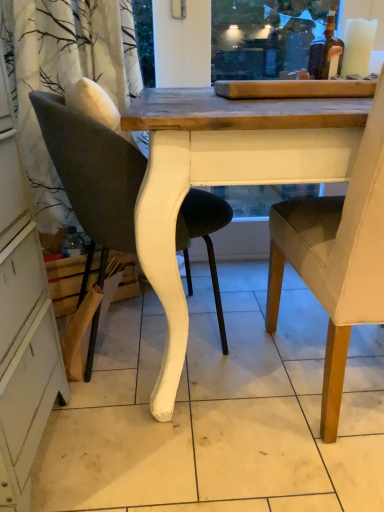
Question: Considering the relative sizes of white painted wood chair at left, the 2th chair viewed from the right, and light brown fabric chair at right, which is the 1th chair in right-to-left order, in the image provided, is white painted wood chair at left, the 2th chair viewed from the right, taller than light brown fabric chair at right, which is the 1th chair in right-to-left order,?

Choices:
 (A) no
 (B) yes

Answer: (A)

Question: From the image's perspective, is white painted wood chair at left, which is the 1th chair in left-to-right order, located above light brown fabric chair at right, the 2th chair in the left-to-right sequence?

Choices:
 (A) yes
 (B) no

Answer: (A)

Question: Is light brown fabric chair at right, the 2th chair in the left-to-right sequence, inside white painted wood chair at left, the 2th chair viewed from the right?

Choices:
 (A) no
 (B) yes

Answer: (A)

Question: Is white painted wood chair at left, the 2th chair viewed from the right, not near light brown fabric chair at right, which is the 1th chair in right-to-left order?

Choices:
 (A) yes
 (B) no

Answer: (B)

Question: Can you confirm if white painted wood chair at left, the 2th chair viewed from the right, is wider than light brown fabric chair at right, which is the 1th chair in right-to-left order?

Choices:
 (A) yes
 (B) no

Answer: (B)

Question: From a real-world perspective, is white painted wood chair at left, which is the 1th chair in left-to-right order, on top of light brown fabric chair at right, the 2th chair in the left-to-right sequence?

Choices:
 (A) yes
 (B) no

Answer: (B)

Question: Is light brown fabric chair at right, which is the 1th chair in right-to-left order, located outside white painted wood chair at left, the 2th chair viewed from the right?

Choices:
 (A) no
 (B) yes

Answer: (B)

Question: Can you confirm if light brown fabric chair at right, which is the 1th chair in right-to-left order, is positioned to the left of white painted wood chair at left, the 2th chair viewed from the right?

Choices:
 (A) no
 (B) yes

Answer: (A)

Question: Is there a large distance between light brown fabric chair at right, the 2th chair in the left-to-right sequence, and white painted wood chair at left, which is the 1th chair in left-to-right order?

Choices:
 (A) no
 (B) yes

Answer: (A)

Question: Does light brown fabric chair at right, the 2th chair in the left-to-right sequence, have a larger size compared to white painted wood chair at left, which is the 1th chair in left-to-right order?

Choices:
 (A) yes
 (B) no

Answer: (A)

Question: From a real-world perspective, does light brown fabric chair at right, the 2th chair in the left-to-right sequence, stand above white painted wood chair at left, which is the 1th chair in left-to-right order?

Choices:
 (A) yes
 (B) no

Answer: (A)

Question: Considering the relative sizes of light brown fabric chair at right, the 2th chair in the left-to-right sequence, and white painted wood chair at left, the 2th chair viewed from the right, in the image provided, is light brown fabric chair at right, the 2th chair in the left-to-right sequence, shorter than white painted wood chair at left, the 2th chair viewed from the right,?

Choices:
 (A) yes
 (B) no

Answer: (B)

Question: Considering the positions of light brown fabric chair at right, the 2th chair in the left-to-right sequence, and white painted wood chair at left, which is the 1th chair in left-to-right order, in the image, is light brown fabric chair at right, the 2th chair in the left-to-right sequence, taller or shorter than white painted wood chair at left, which is the 1th chair in left-to-right order,?

Choices:
 (A) short
 (B) tall

Answer: (B)